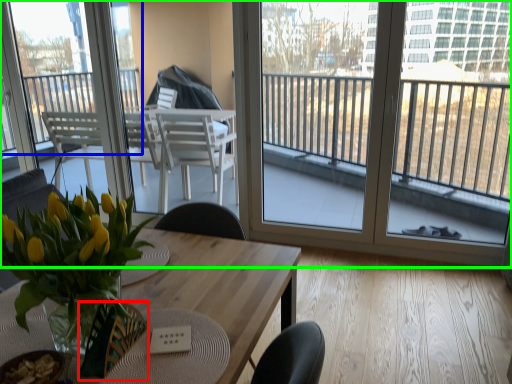
Question: Which is farther away from armchair (highlighted by a red box)? window (highlighted by a blue box) or window (highlighted by a green box)?

Choices:
 (A) window
 (B) window

Answer: (B)